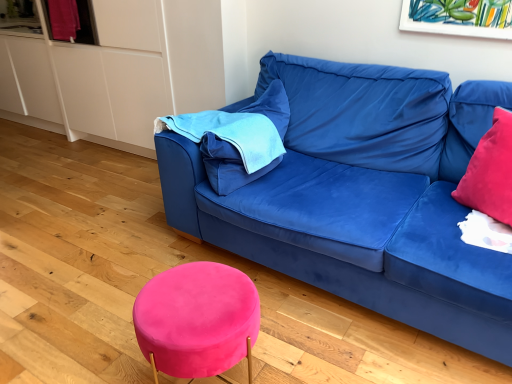
Question: Is blue fabric pillow at upper left outside of velvet pink stool at lower center?

Choices:
 (A) no
 (B) yes

Answer: (B)

Question: Does blue fabric pillow at upper left lie behind velvet pink stool at lower center?

Choices:
 (A) no
 (B) yes

Answer: (B)

Question: Considering the relative sizes of blue fabric pillow at upper left and velvet pink stool at lower center in the image provided, is blue fabric pillow at upper left bigger than velvet pink stool at lower center?

Choices:
 (A) yes
 (B) no

Answer: (B)

Question: Considering the relative positions of blue fabric pillow at upper left and velvet pink stool at lower center in the image provided, is blue fabric pillow at upper left in front of velvet pink stool at lower center?

Choices:
 (A) no
 (B) yes

Answer: (A)

Question: From a real-world perspective, does blue fabric pillow at upper left sit lower than velvet pink stool at lower center?

Choices:
 (A) yes
 (B) no

Answer: (B)

Question: From a real-world perspective, is velvet blue couch at center above or below velvet red pillow at right?

Choices:
 (A) above
 (B) below

Answer: (B)

Question: In terms of width, does velvet blue couch at center look wider or thinner when compared to velvet red pillow at right?

Choices:
 (A) wide
 (B) thin

Answer: (A)

Question: Based on their positions, is velvet blue couch at center located to the left or right of velvet red pillow at right?

Choices:
 (A) left
 (B) right

Answer: (A)

Question: Is velvet blue couch at center in front of or behind velvet red pillow at right in the image?

Choices:
 (A) behind
 (B) front

Answer: (B)

Question: Considering the positions of point (481, 144) and point (408, 94), is point (481, 144) closer or farther from the camera than point (408, 94)?

Choices:
 (A) farther
 (B) closer

Answer: (B)

Question: Based on their sizes in the image, would you say velvet red pillow at right is bigger or smaller than velvet blue couch at center?

Choices:
 (A) big
 (B) small

Answer: (B)

Question: In terms of width, does velvet red pillow at right look wider or thinner when compared to velvet blue couch at center?

Choices:
 (A) thin
 (B) wide

Answer: (A)

Question: Considering the relative positions of velvet red pillow at right and velvet blue couch at center in the image provided, is velvet red pillow at right to the left or to the right of velvet blue couch at center?

Choices:
 (A) right
 (B) left

Answer: (A)

Question: From their relative heights in the image, would you say velvet red pillow at right is taller or shorter than velvet pink stool at lower center?

Choices:
 (A) short
 (B) tall

Answer: (A)

Question: In the image, is velvet red pillow at right positioned in front of or behind velvet pink stool at lower center?

Choices:
 (A) behind
 (B) front

Answer: (A)